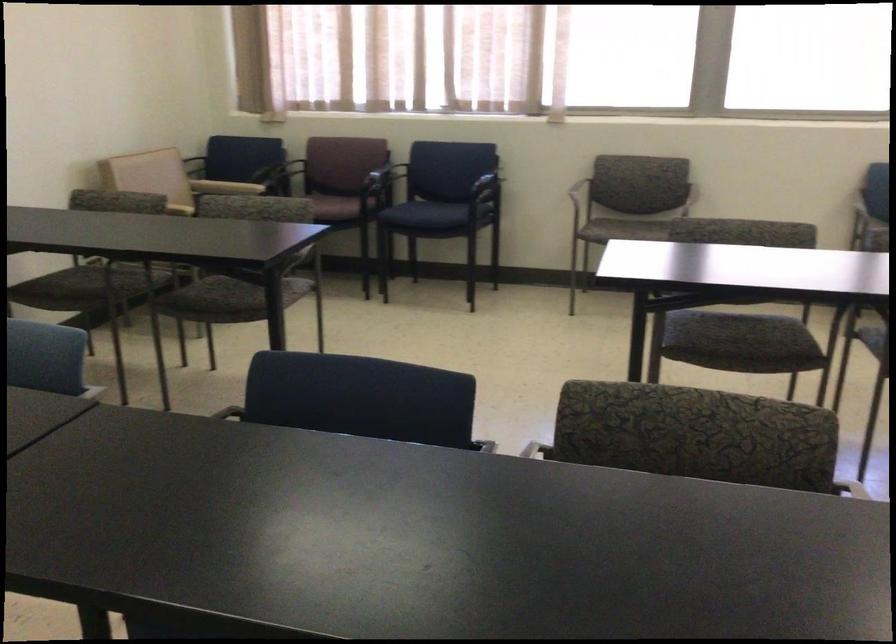
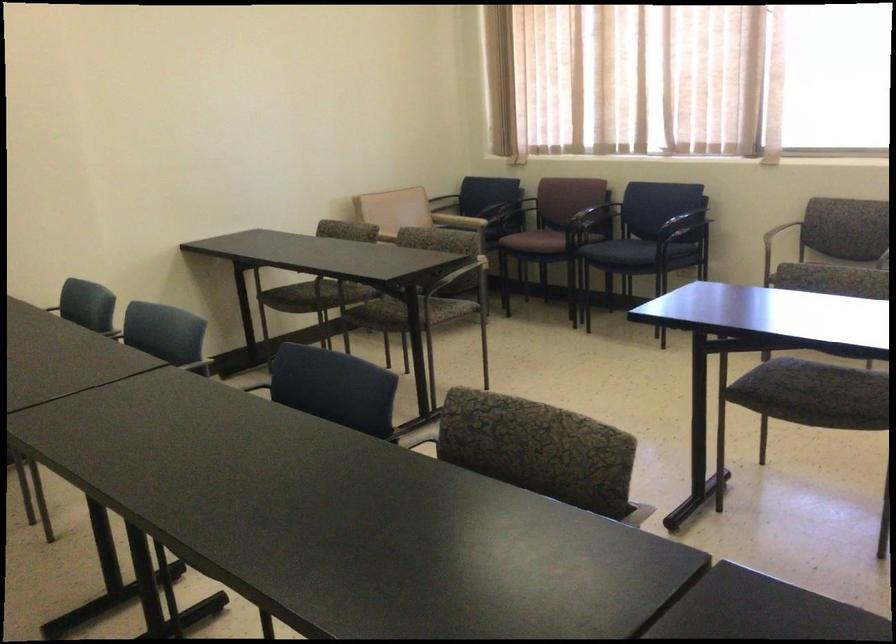
In the second image, find the point that corresponds to [330,386] in the first image.

(332, 386)